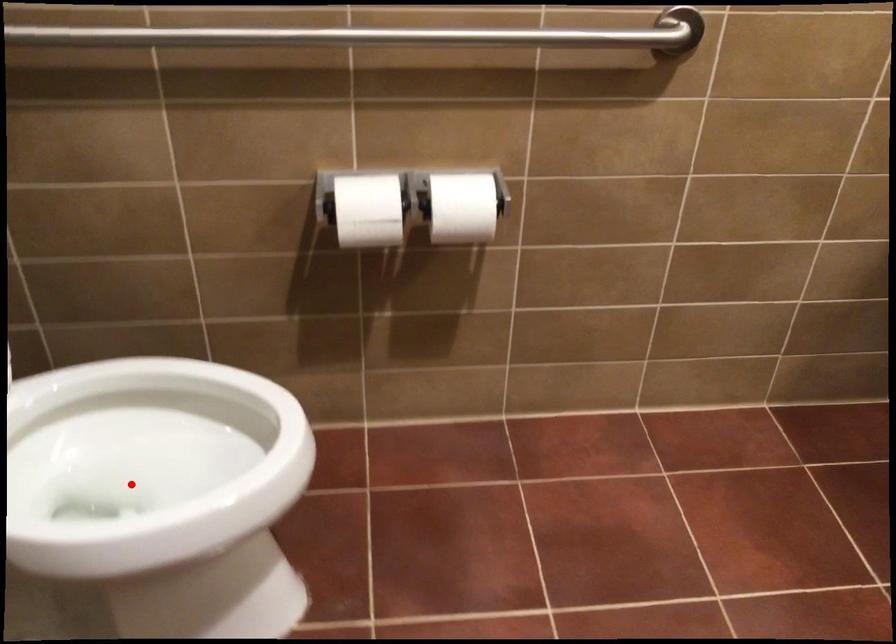
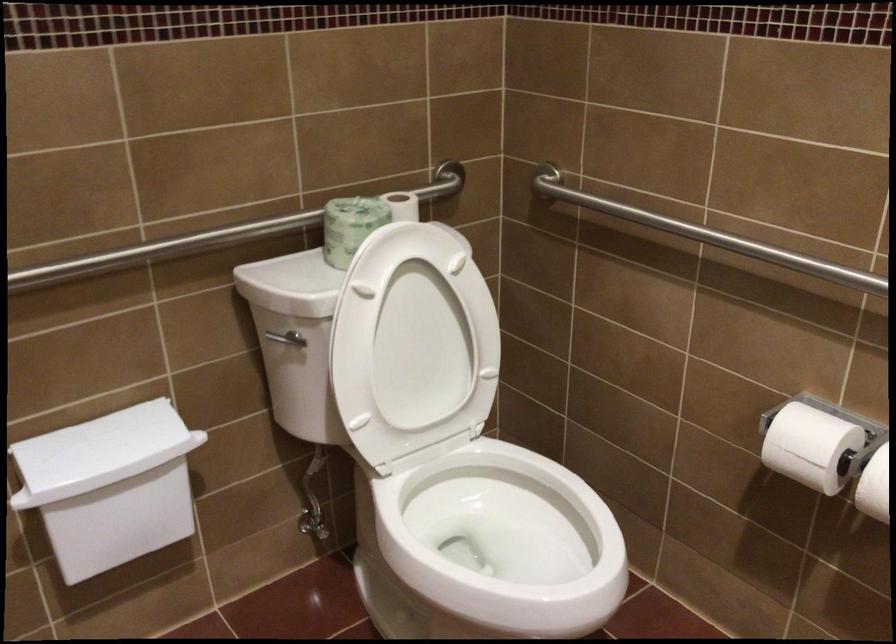
Find the pixel in the second image that matches the highlighted location in the first image.

(497, 544)